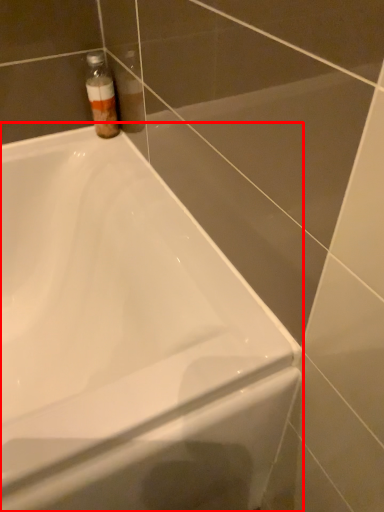
Question: Where is bathtub (annotated by the red box) located in relation to bottle in the image?

Choices:
 (A) right
 (B) left

Answer: (B)